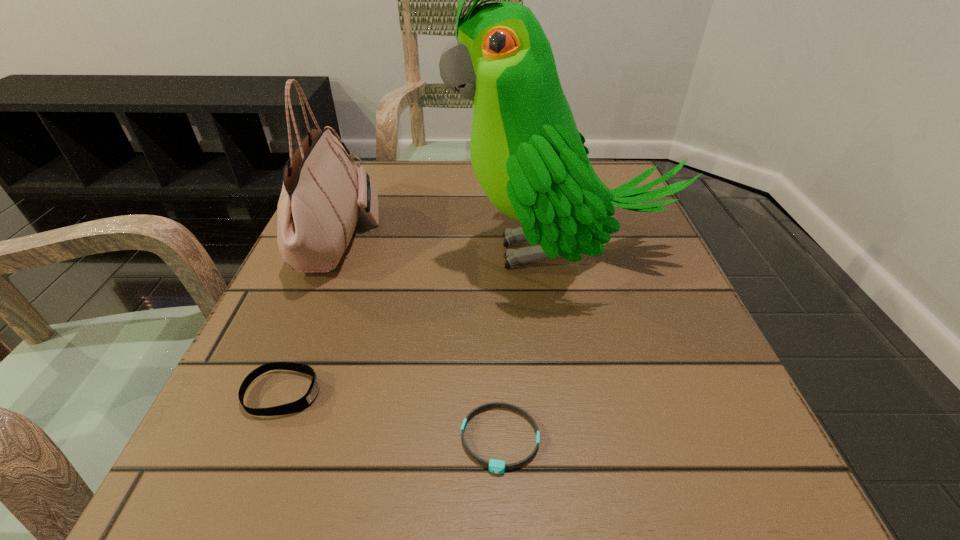
Where is `empty location between the shorter wristband and the second tallest object`? empty location between the shorter wristband and the second tallest object is located at coordinates (420, 339).

I want to click on free space between the parakeet and the second shortest object, so click(x=420, y=323).

Where is `vacant space in between the taller wristband and the shortest object`? The image size is (960, 540). vacant space in between the taller wristband and the shortest object is located at coordinates (392, 416).

This screenshot has width=960, height=540. I want to click on object that is the third nearest to the third tallest object, so click(x=530, y=159).

Select which object is the third closest to the tallest object. Please provide its 2D coordinates. Your answer should be formatted as a tuple, i.e. [(x, y)], where the tuple contains the x and y coordinates of a point satisfying the conditions above.

[(301, 404)]

The image size is (960, 540). Identify the location of free location that satisfies the following two spatial constraints: 1. on the beak of the tallest object; 2. on the buckle of the shorter wristband. (598, 439).

Find the location of `free space in the image that satisfies the following two spatial constraints: 1. on the beak of the tallest object; 2. on the buckle of the right wristband`. free space in the image that satisfies the following two spatial constraints: 1. on the beak of the tallest object; 2. on the buckle of the right wristband is located at coordinates (598, 439).